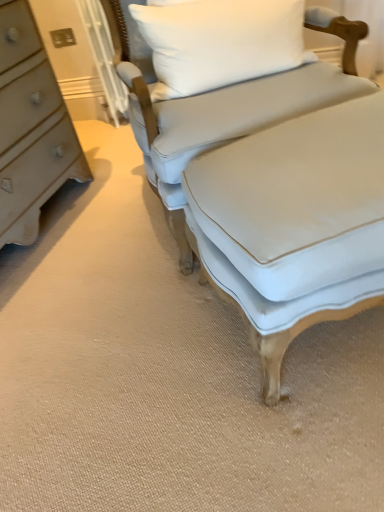
Question: Is light blue fabric couch at center to the left of light blue fabric ottoman at center from the viewer's perspective?

Choices:
 (A) no
 (B) yes

Answer: (B)

Question: Is the surface of light blue fabric couch at center in direct contact with light blue fabric ottoman at center?

Choices:
 (A) yes
 (B) no

Answer: (B)

Question: Is light blue fabric couch at center taller than light blue fabric ottoman at center?

Choices:
 (A) yes
 (B) no

Answer: (A)

Question: Considering the relative sizes of light blue fabric couch at center and light blue fabric ottoman at center in the image provided, is light blue fabric couch at center shorter than light blue fabric ottoman at center?

Choices:
 (A) yes
 (B) no

Answer: (B)

Question: Is light blue fabric ottoman at center inside light blue fabric couch at center?

Choices:
 (A) no
 (B) yes

Answer: (A)

Question: Does point (185, 64) appear closer or farther from the camera than point (292, 263)?

Choices:
 (A) closer
 (B) farther

Answer: (B)

Question: From a real-world perspective, relative to light blue fabric ottoman at center, is white fabric pillow at upper center vertically above or below?

Choices:
 (A) below
 (B) above

Answer: (B)

Question: Choose the correct answer: Is white fabric pillow at upper center inside light blue fabric ottoman at center or outside it?

Choices:
 (A) outside
 (B) inside

Answer: (A)

Question: Relative to light blue fabric ottoman at center, is white fabric pillow at upper center in front or behind?

Choices:
 (A) behind
 (B) front

Answer: (A)

Question: From the image's perspective, is light blue fabric ottoman at center positioned above or below light blue fabric couch at center?

Choices:
 (A) above
 (B) below

Answer: (B)

Question: Is light blue fabric ottoman at center inside the boundaries of light blue fabric couch at center, or outside?

Choices:
 (A) inside
 (B) outside

Answer: (B)

Question: From their relative heights in the image, would you say light blue fabric ottoman at center is taller or shorter than light blue fabric couch at center?

Choices:
 (A) tall
 (B) short

Answer: (B)

Question: In the image, is light blue fabric ottoman at center on the left side or the right side of light blue fabric couch at center?

Choices:
 (A) left
 (B) right

Answer: (B)

Question: From a real-world perspective, is light blue fabric couch at center physically located above or below light blue fabric ottoman at center?

Choices:
 (A) below
 (B) above

Answer: (B)

Question: From the image's perspective, is light blue fabric couch at center above or below light blue fabric ottoman at center?

Choices:
 (A) above
 (B) below

Answer: (A)